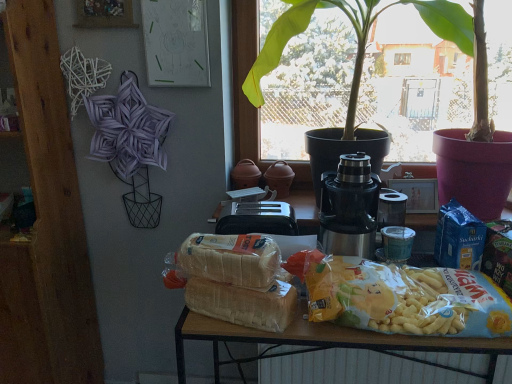
Question: Would you consider white textured radiator at lower center to be distant from matte paper drawing at upper center?

Choices:
 (A) yes
 (B) no

Answer: (A)

Question: Is white textured radiator at lower center further to the viewer compared to matte paper drawing at upper center?

Choices:
 (A) no
 (B) yes

Answer: (B)

Question: From the image's perspective, is white textured radiator at lower center under matte paper drawing at upper center?

Choices:
 (A) no
 (B) yes

Answer: (B)

Question: From the image's perspective, does white textured radiator at lower center appear higher than matte paper drawing at upper center?

Choices:
 (A) yes
 (B) no

Answer: (B)

Question: Considering the relative sizes of white textured radiator at lower center and matte paper drawing at upper center in the image provided, is white textured radiator at lower center shorter than matte paper drawing at upper center?

Choices:
 (A) no
 (B) yes

Answer: (B)

Question: Does white textured radiator at lower center have a smaller size compared to matte paper drawing at upper center?

Choices:
 (A) yes
 (B) no

Answer: (B)

Question: Considering the relative sizes of translucent plastic bag of chips at center, which is counted as the 3th yoghurt, starting from the right, and matte paper drawing at upper center in the image provided, is translucent plastic bag of chips at center, which is counted as the 3th yoghurt, starting from the right, bigger than matte paper drawing at upper center?

Choices:
 (A) no
 (B) yes

Answer: (B)

Question: Can you confirm if translucent plastic bag of chips at center, arranged as the first yoghurt when viewed from the left, is positioned to the right of matte paper drawing at upper center?

Choices:
 (A) yes
 (B) no

Answer: (A)

Question: Does translucent plastic bag of chips at center, which is counted as the 3th yoghurt, starting from the right, have a greater width compared to matte paper drawing at upper center?

Choices:
 (A) no
 (B) yes

Answer: (B)

Question: From a real-world perspective, is translucent plastic bag of chips at center, which is counted as the 3th yoghurt, starting from the right, on matte paper drawing at upper center?

Choices:
 (A) yes
 (B) no

Answer: (B)

Question: Is translucent plastic bag of chips at center, which is counted as the 3th yoghurt, starting from the right, positioned in front of matte paper drawing at upper center?

Choices:
 (A) no
 (B) yes

Answer: (B)

Question: Considering the relative positions of translucent plastic bag of chips at center, which is counted as the 3th yoghurt, starting from the right, and matte paper drawing at upper center in the image provided, is translucent plastic bag of chips at center, which is counted as the 3th yoghurt, starting from the right, to the left of matte paper drawing at upper center from the viewer's perspective?

Choices:
 (A) no
 (B) yes

Answer: (A)

Question: Could translucent plastic bag of chips at center, which is counted as the 3th yoghurt, starting from the right, be considered to be inside matte plastic table at center?

Choices:
 (A) yes
 (B) no

Answer: (B)